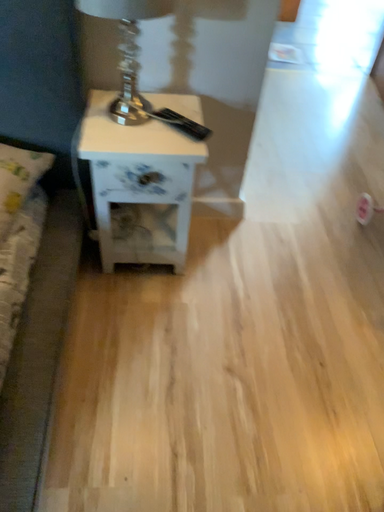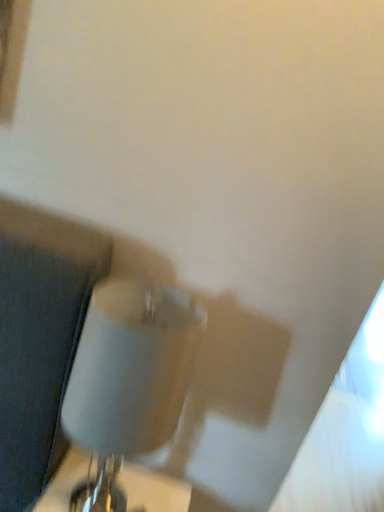
Question: Which way did the camera rotate in the video?

Choices:
 (A) rotated downward
 (B) rotated upward

Answer: (B)